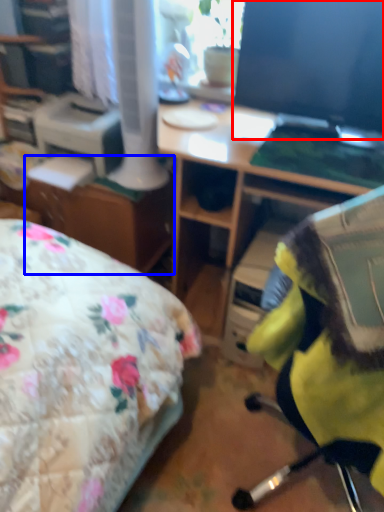
Question: Which of the following is the closest to the observer, computer monitor (highlighted by a red box) or file cabinet (highlighted by a blue box)?

Choices:
 (A) computer monitor
 (B) file cabinet

Answer: (A)